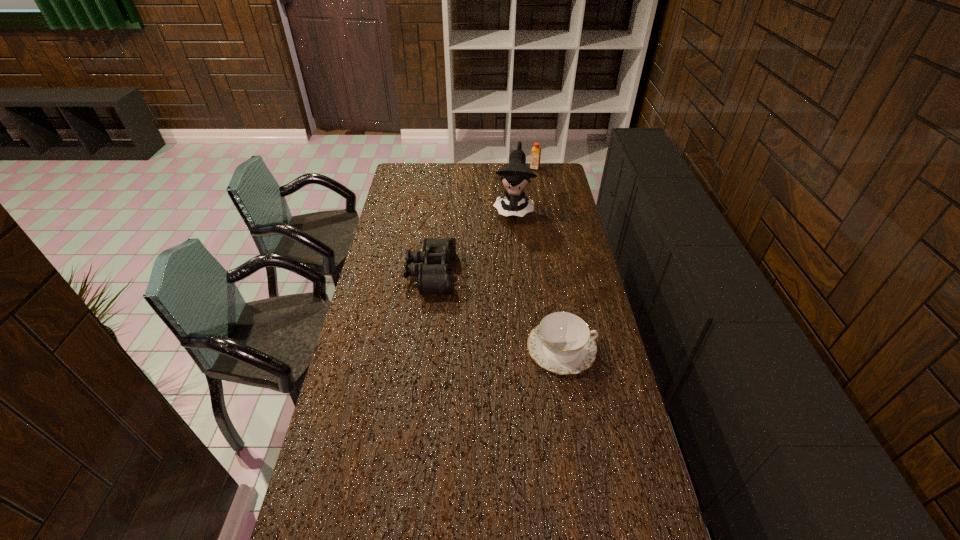
This screenshot has width=960, height=540. I want to click on free spot on the desktop that is between the leftmost object and the chinaware and is positioned at the face of the third nearest object, so click(496, 311).

The image size is (960, 540). I want to click on vacant space on the desktop that is between the binoculars and the chinaware and is positioned on the front and back of the orange juice, so click(490, 307).